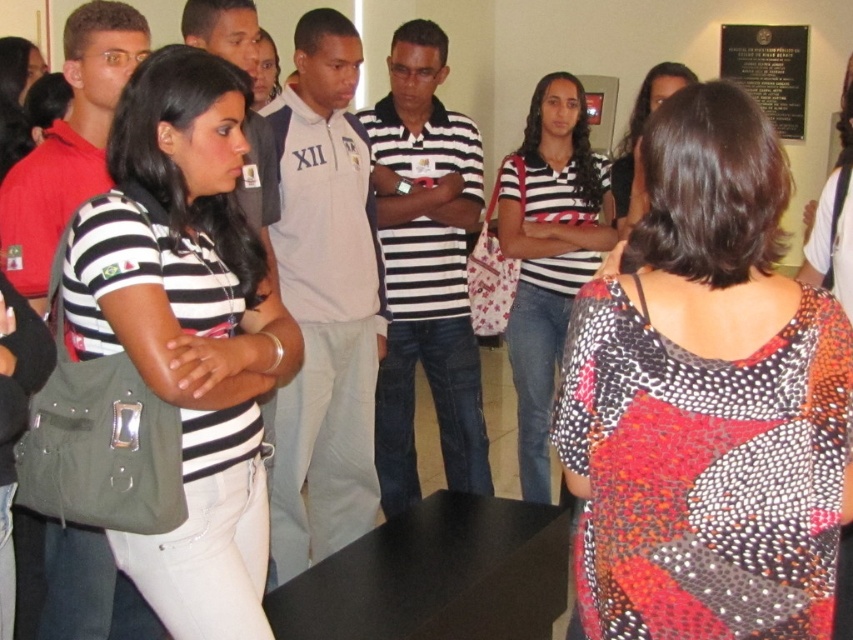
Does matte black shirt at center have a greater height compared to striped cotton shirt at center?

Incorrect, matte black shirt at center's height is not larger of striped cotton shirt at center's.

Is matte black shirt at center shorter than striped cotton shirt at center?

Correct, matte black shirt at center is not as tall as striped cotton shirt at center.

Where is `matte black shirt at center`? The width and height of the screenshot is (853, 640). matte black shirt at center is located at coordinates (189, 330).

Is matte black shirt at center to the right of black polished stone plaque at upper right from the viewer's perspective?

In fact, matte black shirt at center is to the left of black polished stone plaque at upper right.

Who is positioned more to the right, matte black shirt at center or black polished stone plaque at upper right?

Positioned to the right is black polished stone plaque at upper right.

Does point (194, 147) come behind point (802, 76)?

That is False.

Locate an element on the screen. The width and height of the screenshot is (853, 640). matte black shirt at center is located at coordinates (189, 330).

Can you confirm if striped cotton shirt at center is bigger than black polished stone plaque at upper right?

Yes.

At what (x,y) coordinates should I click in order to perform the action: click on striped cotton shirt at center. Please return your answer as a coordinate pair (x, y). Looking at the image, I should click on (548, 253).